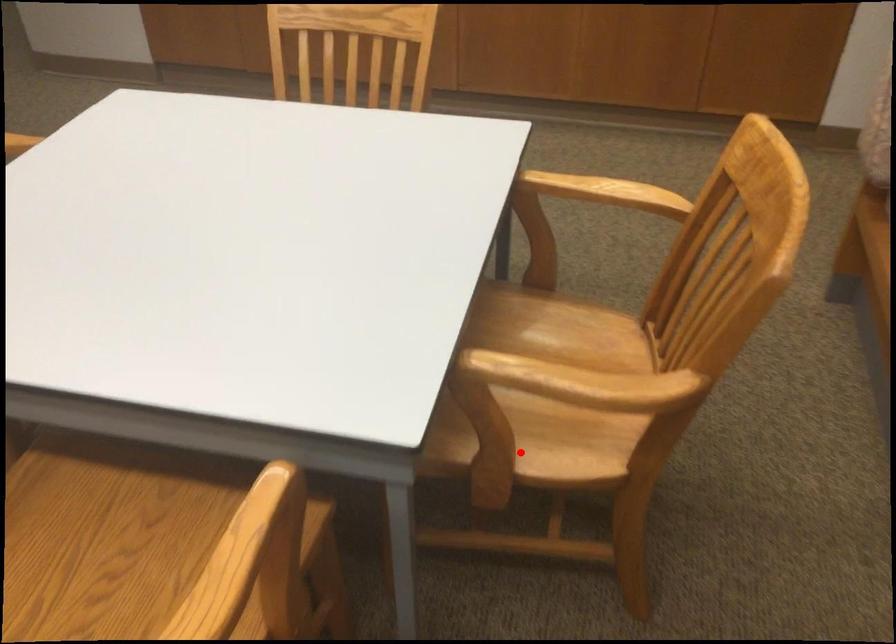
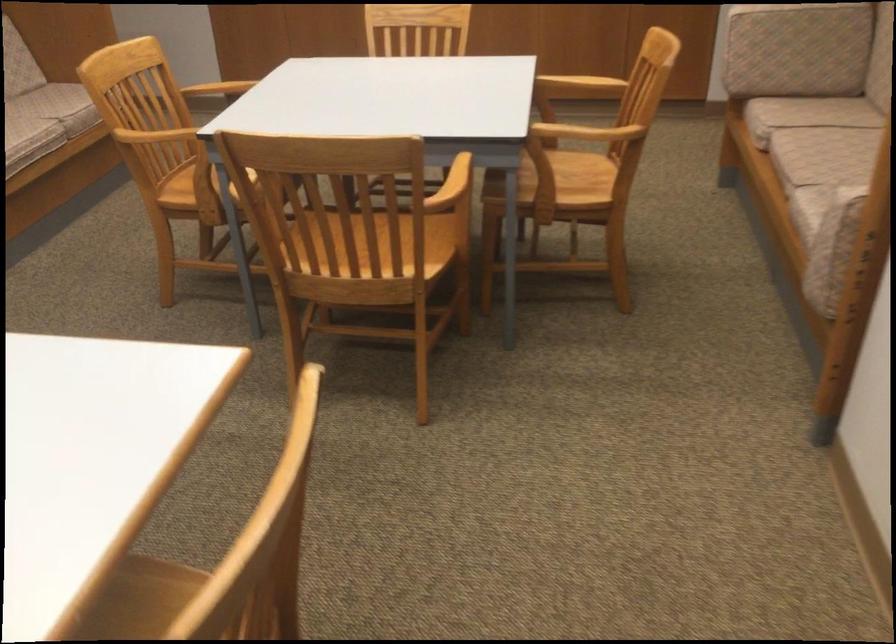
Question: I am providing you with two images of the same scene from different viewpoints. A red point is shown in image1. For the corresponding object point in image2, is it positioned nearer or farther from the camera?

Choices:
 (A) Nearer
 (B) Farther

Answer: (B)